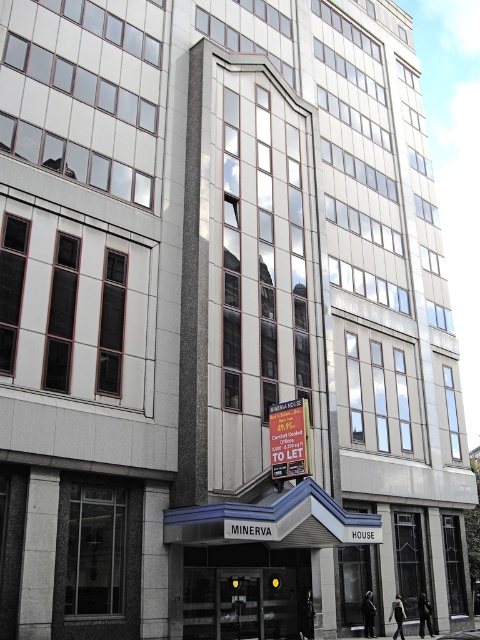
Question: Does transparent glass doors at center appear under yellow paper sign at center?

Choices:
 (A) no
 (B) yes

Answer: (B)

Question: Among these points, which one is farthest from the camera?

Choices:
 (A) (273, 417)
 (B) (280, 609)

Answer: (B)

Question: Can you confirm if transparent glass doors at center is smaller than yellow paper sign at center?

Choices:
 (A) no
 (B) yes

Answer: (B)

Question: Can you confirm if transparent glass doors at center is wider than yellow paper sign at center?

Choices:
 (A) no
 (B) yes

Answer: (A)

Question: Which point is closer to the camera?

Choices:
 (A) (274, 440)
 (B) (276, 563)

Answer: (A)